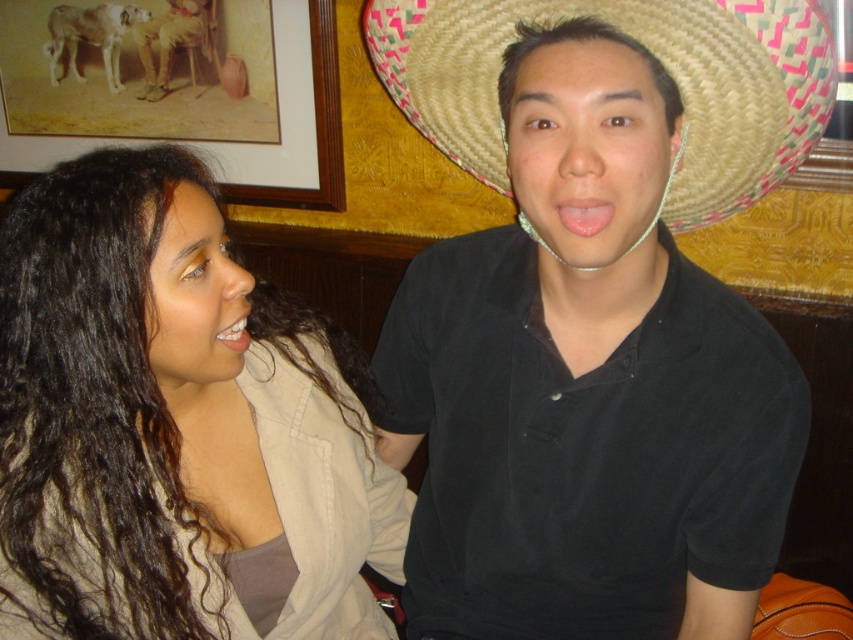
You are a photographer trying to capture a candid shot of the white glossy teeth at lower left without the straw hat at upper center blocking the view. Is this possible given their positions?

The straw hat at upper center is above the white glossy teeth at lower left, so it may block the view. To capture the teeth without obstruction, adjust the camera angle downward to avoid the hat.

You are a photographer who wants to ensure that both the black matte shirt at center and the dark brown curly hair at left are clearly visible in your photo. Given their sizes, which object should you focus on to ensure proper exposure?

The black matte shirt at center is bigger than the dark brown curly hair at left, so focusing on the black matte shirt at center would ensure proper exposure since it has a larger surface area to work with.

You are a photographer standing at the camera position. You want to take a closeup shot of the wooden framed picture at upper left. The lens you have can focus as close as 5 feet. Will you be able to focus on the picture?

The wooden framed picture at upper left is 5.27 feet away from the camera. Since the lens can focus as close as 5 feet, the distance of 5.27 feet is slightly beyond the minimum focusing distance. Therefore, the photographer will not be able to focus on the wooden framed picture at upper left with the current lens.